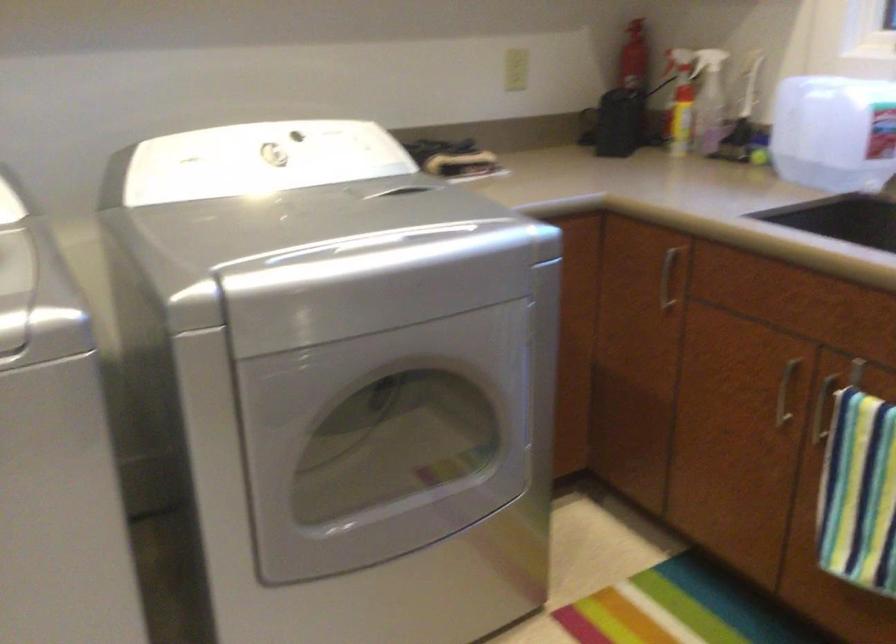
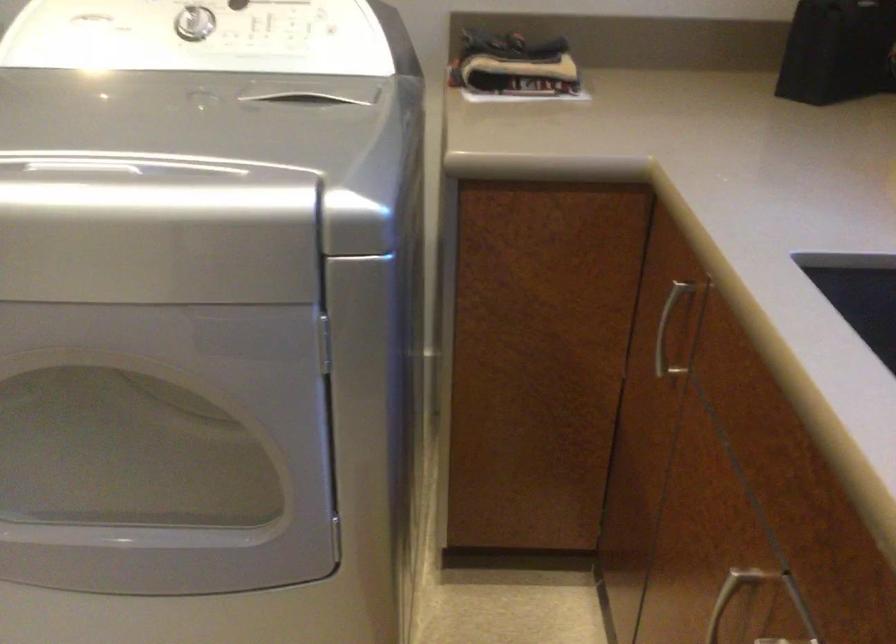
Question: The first image is from the beginning of the video and the second image is from the end. How did the camera likely rotate when shooting the video?

Choices:
 (A) Left
 (B) Right
 (C) Up
 (D) Down

Answer: (A)